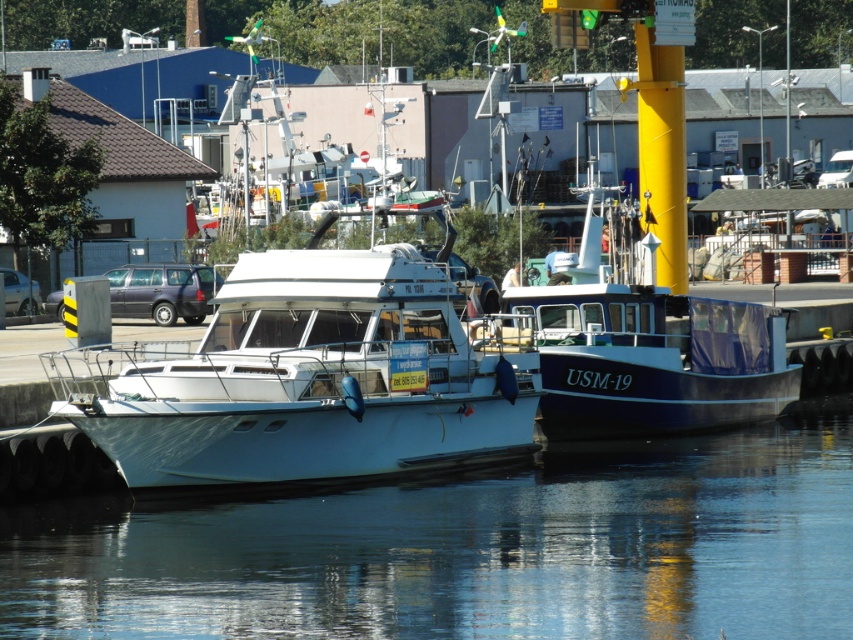
Can you confirm if transparent water at lower center is taller than white glossy boat at center?

Indeed, transparent water at lower center has a greater height compared to white glossy boat at center.

Does transparent water at lower center have a lesser width compared to white glossy boat at center?

In fact, transparent water at lower center might be wider than white glossy boat at center.

Between point (648, 500) and point (463, 387), which one is positioned behind?

Point (463, 387)

Locate an element on the screen. This screenshot has width=853, height=640. transparent water at lower center is located at coordinates (469, 548).